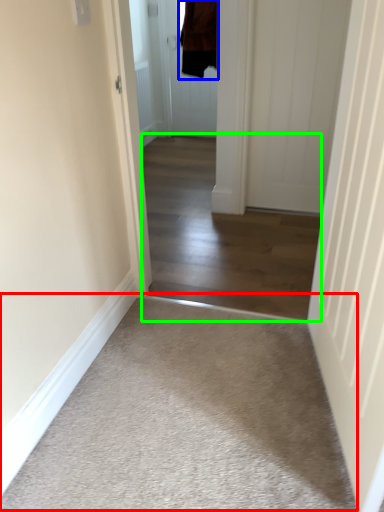
Question: Which is nearer to the plain (highlighted by a red box)? jacket (highlighted by a blue box) or corridor (highlighted by a green box).

Choices:
 (A) jacket
 (B) corridor

Answer: (B)